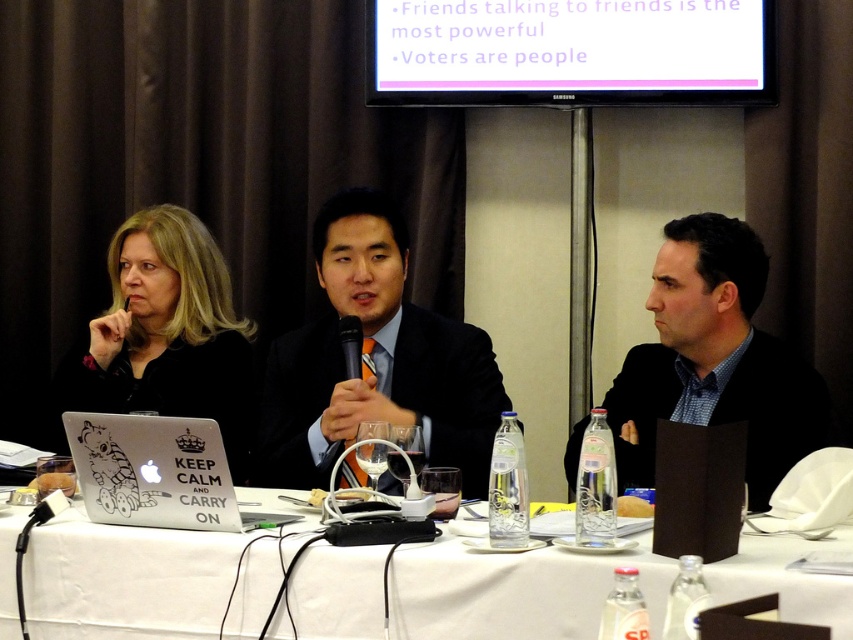
You are a photographer setting up for a panel discussion. You need to position a camera to capture both the matte black suit at center and the white matte laptop at lower left. Based on their positions, which object should be placed further to the right in your frame?

The matte black suit at center is to the right of the white matte laptop at lower left, so the matte black suit at center should be placed further to the right in the frame.

Looking at this image, you are organizing a presentation and need to place a 12cm tall document holder on the table. Given the height of the white fabric table at center and the black matte laptop at left, where should you place it to ensure it doesn

The white fabric table at center is not as tall as the black matte laptop at left, so placing the document holder on the white fabric table at center would be more stable since it is lower and provides a flat surface.

You are an event planner trying to place a name tag on the table for the speaker at the center. The coordinates provided are point (375, 360). Based on the scene description, where exactly should you place the name tag?

The point (375, 360) is on the matte black suit at center, so the name tag should be placed on the matte black suit at center where the coordinates are located.